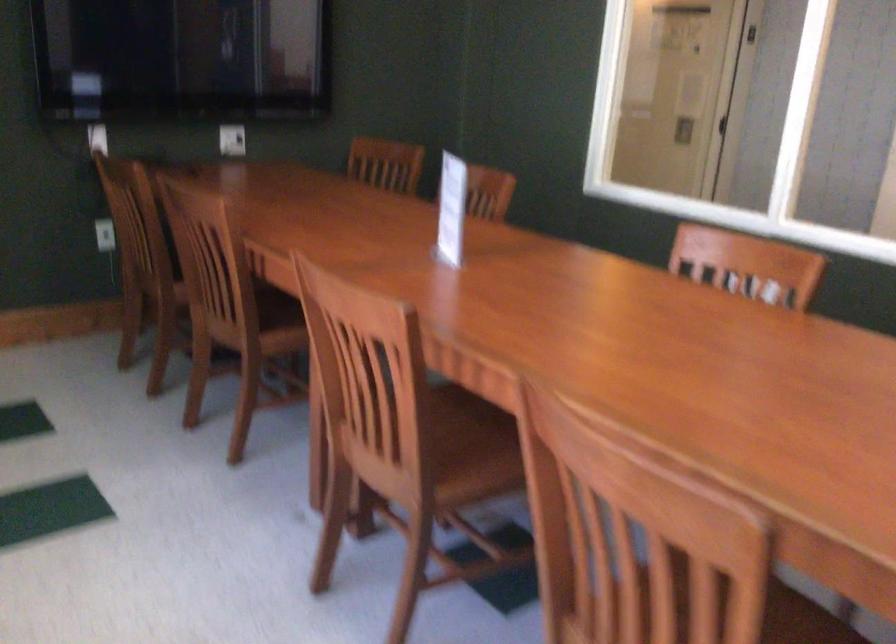
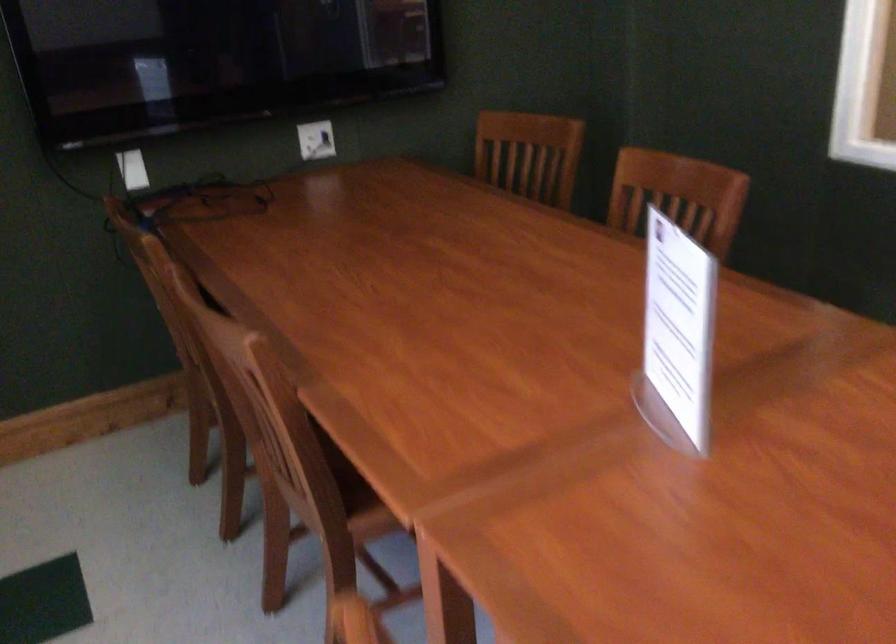
Find the pixel in the second image that matches (x=458, y=214) in the first image.

(677, 335)